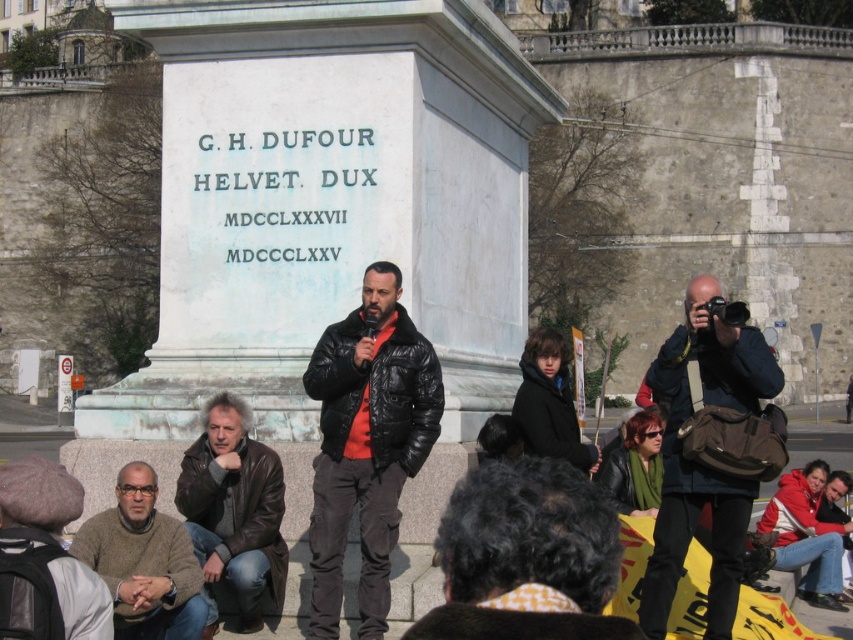
You are a photographer trying to capture both the dark blue jacket at right and the leather jacket at lower left in the same frame. Based on their positions, which jacket is positioned closer to the edge of the frame?

The dark blue jacket at right is positioned closer to the edge of the frame because it is located at the right side, while the leather jacket at lower left is situated at the lower left corner, which is farther from the right edge.

You are standing at point A, which is at coordinates point (679, 371). You want to walk to point B at coordinates point (251, 547). Which direction should you move relative to the monument?

To move from point (679, 371) to point (251, 547), you should move towards the monument since point (679, 371) is behind point (251, 547) relative to the monument.